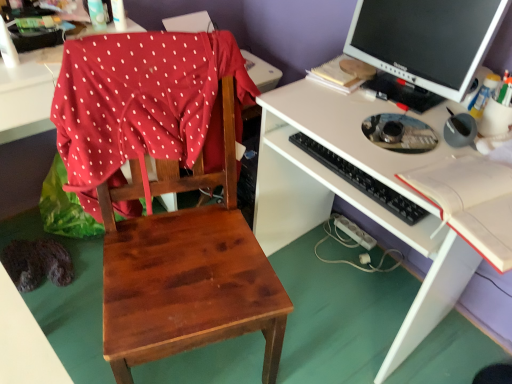
Question: Is black plastic keyboard at center turned away from matte black monitor at upper right?

Choices:
 (A) no
 (B) yes

Answer: (A)

Question: From a real-world perspective, is black plastic keyboard at center on matte black monitor at upper right?

Choices:
 (A) yes
 (B) no

Answer: (B)

Question: Is black plastic keyboard at center shorter than matte black monitor at upper right?

Choices:
 (A) yes
 (B) no

Answer: (A)

Question: Considering the relative sizes of black plastic keyboard at center and matte black monitor at upper right in the image provided, is black plastic keyboard at center thinner than matte black monitor at upper right?

Choices:
 (A) no
 (B) yes

Answer: (B)

Question: Considering the relative positions of black plastic keyboard at center and matte black monitor at upper right in the image provided, is black plastic keyboard at center to the left of matte black monitor at upper right from the viewer's perspective?

Choices:
 (A) yes
 (B) no

Answer: (A)

Question: From a real-world perspective, is red polka dot fabric at left above or below matte black monitor at upper right?

Choices:
 (A) below
 (B) above

Answer: (A)

Question: In terms of width, does red polka dot fabric at left look wider or thinner when compared to matte black monitor at upper right?

Choices:
 (A) thin
 (B) wide

Answer: (A)

Question: Is point (214, 34) positioned closer to the camera than point (407, 9)?

Choices:
 (A) farther
 (B) closer

Answer: (B)

Question: Considering the positions of red polka dot fabric at left and matte black monitor at upper right in the image, is red polka dot fabric at left taller or shorter than matte black monitor at upper right?

Choices:
 (A) short
 (B) tall

Answer: (B)

Question: From the image's perspective, is red polka dot fabric at left located above or below clear plastic bottle at upper left, marked as the third bottle in a bottom-to-top arrangement?

Choices:
 (A) below
 (B) above

Answer: (A)

Question: Considering the positions of red polka dot fabric at left and clear plastic bottle at upper left, marked as the third bottle in a bottom-to-top arrangement, in the image, is red polka dot fabric at left bigger or smaller than clear plastic bottle at upper left, marked as the third bottle in a bottom-to-top arrangement,?

Choices:
 (A) big
 (B) small

Answer: (A)

Question: Considering the positions of red polka dot fabric at left and clear plastic bottle at upper left, the 1th bottle positioned from the top, in the image, is red polka dot fabric at left wider or thinner than clear plastic bottle at upper left, the 1th bottle positioned from the top,?

Choices:
 (A) wide
 (B) thin

Answer: (A)

Question: Considering the positions of point (209, 94) and point (99, 4), is point (209, 94) closer or farther from the camera than point (99, 4)?

Choices:
 (A) closer
 (B) farther

Answer: (A)

Question: From the image's perspective, is white matte desk at center located above or below red polka dot fabric at left?

Choices:
 (A) below
 (B) above

Answer: (A)

Question: Is point (320, 142) positioned closer to the camera than point (69, 54)?

Choices:
 (A) closer
 (B) farther

Answer: (B)